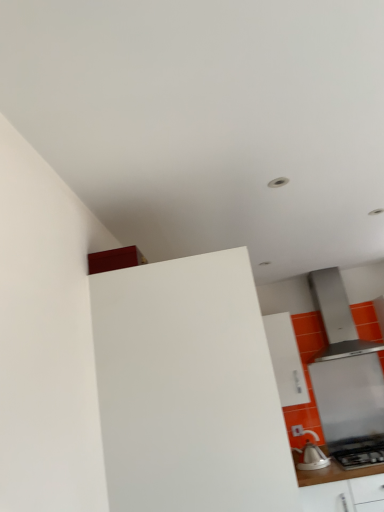
What do you see at coordinates (310, 457) in the screenshot? I see `white glossy kettle at lower right` at bounding box center [310, 457].

This screenshot has height=512, width=384. I want to click on white matte cabinet at center, the 1th cabinetry when ordered from front to back, so click(188, 388).

You are a GUI agent. You are given a task and a screenshot of the screen. Output one action in this format:
    pyautogui.click(x=<x>, y=<y>)
    Task: Click on the white glossy kettle at lower right
    The image size is (384, 512).
    Given the screenshot: What is the action you would take?
    pyautogui.click(x=310, y=457)

Does white glossy cabinet at upper center, acting as the second cabinetry starting from the left, lie in front of white matte cabinet at center, which is the 2th cabinetry in right-to-left order?

No, white glossy cabinet at upper center, acting as the second cabinetry starting from the left, is behind white matte cabinet at center, which is the 2th cabinetry in right-to-left order.

Is point (286, 366) closer or farther from the camera than point (123, 495)?

Point (286, 366) is positioned farther from the camera compared to point (123, 495).

Considering the sizes of objects white glossy cabinet at upper center, which is counted as the 1th cabinetry, starting from the back, and white matte cabinet at center, the 2th cabinetry from the back, in the image provided, who is wider, white glossy cabinet at upper center, which is counted as the 1th cabinetry, starting from the back, or white matte cabinet at center, the 2th cabinetry from the back,?

Wider between the two is white matte cabinet at center, the 2th cabinetry from the back.

Would you consider white glossy kettle at lower right to be distant from satin silver range hood at upper right?

No, there isn't a large distance between white glossy kettle at lower right and satin silver range hood at upper right.

Considering the positions of objects white glossy kettle at lower right and satin silver range hood at upper right in the image provided, who is more to the left, white glossy kettle at lower right or satin silver range hood at upper right?

white glossy kettle at lower right.

Is white glossy kettle at lower right in front of or behind satin silver range hood at upper right in the image?

white glossy kettle at lower right is positioned closer to the viewer than satin silver range hood at upper right.

Is white glossy cabinet at upper center, which is counted as the 1th cabinetry, starting from the back, taller or shorter than satin silver range hood at upper right?

white glossy cabinet at upper center, which is counted as the 1th cabinetry, starting from the back, is shorter than satin silver range hood at upper right.

From the image's perspective, is white glossy cabinet at upper center, acting as the second cabinetry starting from the left, positioned above or below satin silver range hood at upper right?

Clearly, from the image's perspective, white glossy cabinet at upper center, acting as the second cabinetry starting from the left, is below satin silver range hood at upper right.

Are white glossy cabinet at upper center, which is counted as the 1th cabinetry, starting from the back, and satin silver range hood at upper right making contact?

No.

Considering the positions of points (338, 283) and (288, 333), is point (338, 283) closer to camera compared to point (288, 333)?

Yes.

Looking at this image, from a real-world perspective, does satin silver range hood at upper right sit lower than white glossy cabinet at upper center, acting as the second cabinetry starting from the left?

No, from a real-world perspective, satin silver range hood at upper right is not under white glossy cabinet at upper center, acting as the second cabinetry starting from the left.

Is satin silver range hood at upper right in front of or behind white glossy cabinet at upper center, acting as the second cabinetry starting from the left, in the image?

Visually, satin silver range hood at upper right is located in front of white glossy cabinet at upper center, acting as the second cabinetry starting from the left.

Based on the photo, measure the distance between satin silver range hood at upper right and white glossy cabinet at upper center, which is counted as the 1th cabinetry, starting from the back.

14.16 inches.

Is satin silver range hood at upper right bigger or smaller than white matte cabinet at center, which is the 1th cabinetry in left-to-right order?

Considering their sizes, satin silver range hood at upper right takes up less space than white matte cabinet at center, which is the 1th cabinetry in left-to-right order.

From a real-world perspective, is satin silver range hood at upper right physically below white matte cabinet at center, the 1th cabinetry when ordered from front to back?

No, from a real-world perspective, satin silver range hood at upper right is not below white matte cabinet at center, the 1th cabinetry when ordered from front to back.

Considering the positions of objects satin silver range hood at upper right and white matte cabinet at center, the 1th cabinetry when ordered from front to back, in the image provided, who is more to the left, satin silver range hood at upper right or white matte cabinet at center, the 1th cabinetry when ordered from front to back,?

white matte cabinet at center, the 1th cabinetry when ordered from front to back.

Is satin silver range hood at upper right next to white matte cabinet at center, the 2th cabinetry from the back, and touching it?

satin silver range hood at upper right and white matte cabinet at center, the 2th cabinetry from the back, are not in contact.

Does white matte cabinet at center, the 1th cabinetry when ordered from front to back, appear on the right side of white glossy counter at lower right?

In fact, white matte cabinet at center, the 1th cabinetry when ordered from front to back, is to the left of white glossy counter at lower right.

Is white matte cabinet at center, which is the 1th cabinetry in left-to-right order, smaller than white glossy counter at lower right?

No.

Is white matte cabinet at center, which is the 2th cabinetry in right-to-left order, not within white glossy counter at lower right?

Indeed, white matte cabinet at center, which is the 2th cabinetry in right-to-left order, is completely outside white glossy counter at lower right.

Can you confirm if satin silver range hood at right is taller than white matte cabinet at center, the 1th cabinetry when ordered from front to back?

Incorrect, the height of satin silver range hood at right is not larger of that of white matte cabinet at center, the 1th cabinetry when ordered from front to back.

From a real-world perspective, who is located higher, satin silver range hood at right or white matte cabinet at center, the 2th cabinetry from the back?

white matte cabinet at center, the 2th cabinetry from the back, from a real-world perspective.

From the image's perspective, relative to white matte cabinet at center, the 2th cabinetry from the back, is satin silver range hood at right above or below?

Clearly, from the image's perspective, satin silver range hood at right is below white matte cabinet at center, the 2th cabinetry from the back.

At what (x,y) coordinates should I click in order to perform the action: click on cabinetry that is on the left side of white glossy cabinet at upper center, marked as the 2th cabinetry in a front-to-back arrangement. Please return your answer as a coordinate pair (x, y). Looking at the image, I should click on (188, 388).

Identify the location of home appliance behind the white glossy kettle at lower right. The width and height of the screenshot is (384, 512). pos(337,317).

From the image, which object appears to be farther from white glossy kettle at lower right, satin silver range hood at upper right or white glossy counter at lower right?

satin silver range hood at upper right.

Looking at the image, which one is located further to white glossy cabinet at upper center, acting as the second cabinetry starting from the left, satin silver range hood at right or white matte cabinet at center, the 1th cabinetry when ordered from front to back?

The object further to white glossy cabinet at upper center, acting as the second cabinetry starting from the left, is white matte cabinet at center, the 1th cabinetry when ordered from front to back.

From the image, which object appears to be farther from white matte cabinet at center, which is the 1th cabinetry in left-to-right order, white glossy cabinet at upper center, the first cabinetry positioned from the right, or satin silver range hood at right?

The object further to white matte cabinet at center, which is the 1th cabinetry in left-to-right order, is satin silver range hood at right.

Looking at the image, which one is located further to white glossy kettle at lower right, white glossy counter at lower right or satin silver range hood at upper right?

satin silver range hood at upper right.

Based on their spatial positions, is white glossy kettle at lower right or white glossy cabinet at upper center, which is counted as the 1th cabinetry, starting from the back, closer to white matte cabinet at center, the 2th cabinetry from the back?

white glossy kettle at lower right lies closer to white matte cabinet at center, the 2th cabinetry from the back, than the other object.

Looking at the image, which one is located further to white matte cabinet at center, which is the 1th cabinetry in left-to-right order, satin silver range hood at right or white glossy cabinet at upper center, which is counted as the 1th cabinetry, starting from the back?

satin silver range hood at right.

When comparing their distances from white glossy cabinet at upper center, the first cabinetry positioned from the right, does satin silver range hood at right or satin silver range hood at upper right seem further?

Among the two, satin silver range hood at right is located further to white glossy cabinet at upper center, the first cabinetry positioned from the right.

When comparing their distances from white glossy cabinet at upper center, which is counted as the 1th cabinetry, starting from the back, does satin silver range hood at right or white glossy kettle at lower right seem further?

white glossy kettle at lower right.

This screenshot has height=512, width=384. In order to click on kitchen appliance positioned between white glossy counter at lower right and satin silver range hood at right from near to far in this screenshot , I will do `click(310, 457)`.

Find the location of a particular element. The width and height of the screenshot is (384, 512). kitchen appliance between white matte cabinet at center, the 2th cabinetry from the back, and white glossy cabinet at upper center, acting as the second cabinetry starting from the left, along the z-axis is located at coordinates (310, 457).

I want to click on appliance between satin silver range hood at upper right and white glossy kettle at lower right vertically, so click(351, 401).

You are a GUI agent. You are given a task and a screenshot of the screen. Output one action in this format:
    pyautogui.click(x=<x>, y=<y>)
    Task: Click on the home appliance positioned between white matte cabinet at center, the 1th cabinetry when ordered from front to back, and satin silver range hood at right from near to far
    
    Given the screenshot: What is the action you would take?
    pyautogui.click(x=337, y=317)